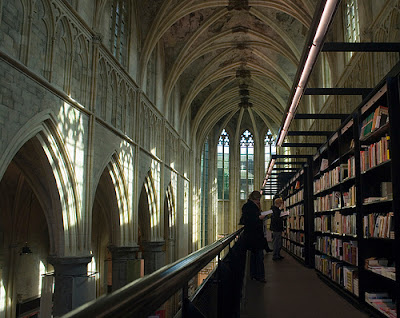
Identify the location of right wall. Image resolution: width=400 pixels, height=318 pixels. (341, 104).